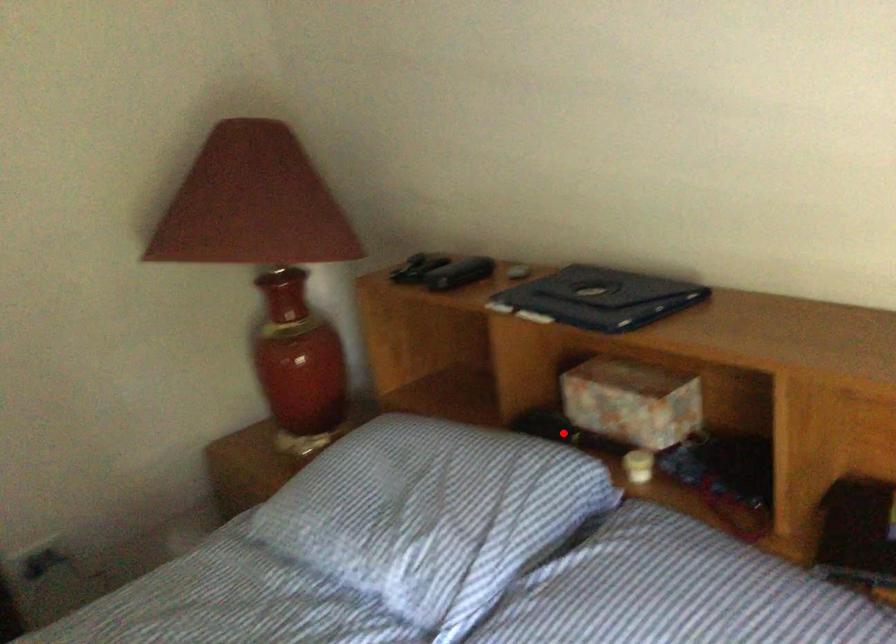
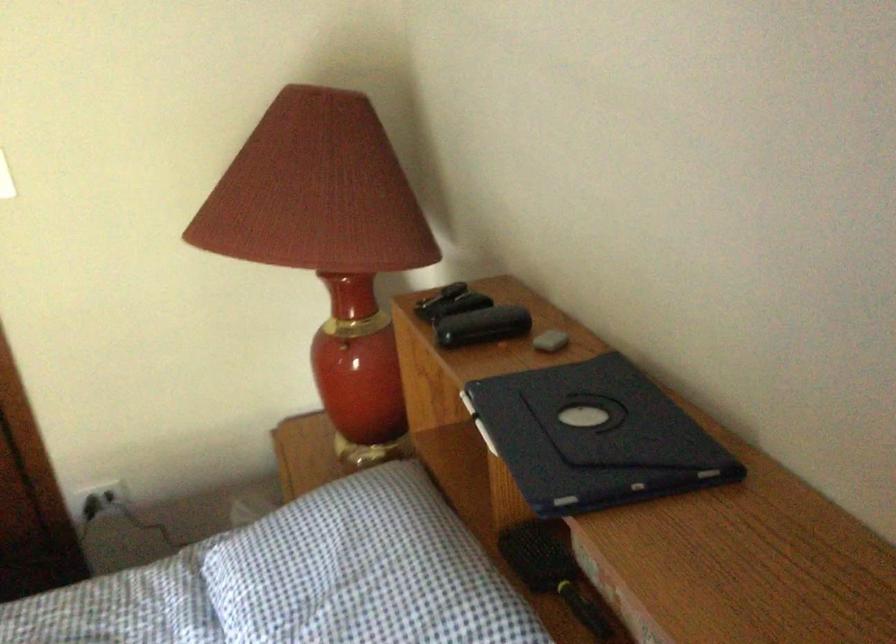
In the second image, find the point that corresponds to the highlighted location in the first image.

(552, 571)